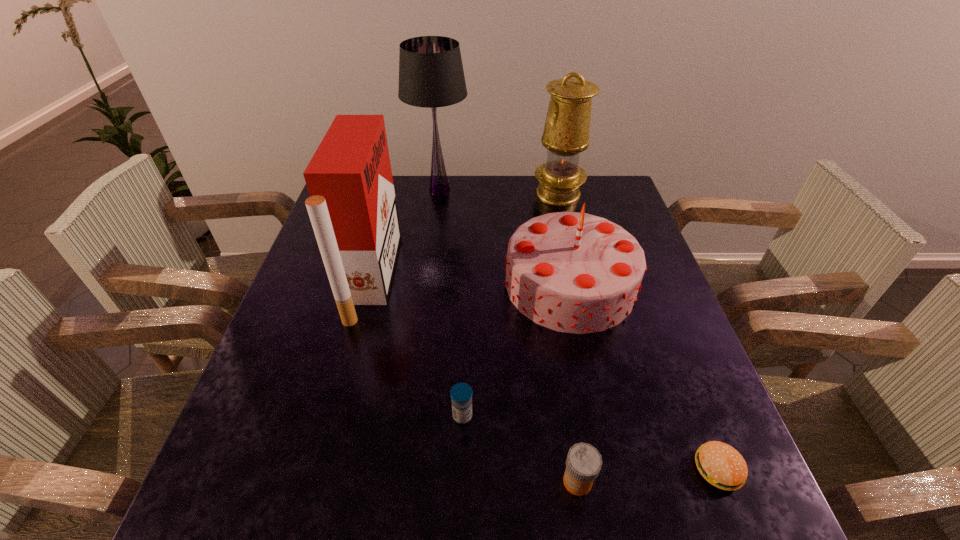
The height and width of the screenshot is (540, 960). In order to click on empty space that is in between the farther medicine and the cigarette case in this screenshot , I will do tap(418, 346).

Where is `vacant space in between the lampshade and the oil lamp`? vacant space in between the lampshade and the oil lamp is located at coordinates (499, 192).

Locate an element on the screen. The image size is (960, 540). vacant space that is in between the right medicine and the left medicine is located at coordinates (520, 449).

Identify which object is located as the sixth nearest to the oil lamp. Please provide its 2D coordinates. Your answer should be formatted as a tuple, i.e. [(x, y)], where the tuple contains the x and y coordinates of a point satisfying the conditions above.

[(583, 463)]

I want to click on object that stands as the second closest to the fourth tallest object, so click(x=461, y=393).

Where is `vacant space that satisfies the following two spatial constraints: 1. on the front-facing side of the cigarette case; 2. on the right side of the birthday cake`? This screenshot has height=540, width=960. vacant space that satisfies the following two spatial constraints: 1. on the front-facing side of the cigarette case; 2. on the right side of the birthday cake is located at coordinates (370, 285).

The height and width of the screenshot is (540, 960). In order to click on free space that satisfies the following two spatial constraints: 1. on the front-facing side of the patty; 2. on the right side of the cigarette case in this screenshot , I will do `click(322, 470)`.

Image resolution: width=960 pixels, height=540 pixels. Identify the location of vacant space that satisfies the following two spatial constraints: 1. on the front-facing side of the lampshade; 2. on the front-facing side of the cigarette case. pos(429,276).

Identify the location of vacant space that satisfies the following two spatial constraints: 1. on the front-facing side of the lampshade; 2. on the front-facing side of the cigarette case. (429, 276).

Where is `vacant position in the image that satisfies the following two spatial constraints: 1. on the front-facing side of the oil lamp; 2. on the right side of the lampshade`? Image resolution: width=960 pixels, height=540 pixels. vacant position in the image that satisfies the following two spatial constraints: 1. on the front-facing side of the oil lamp; 2. on the right side of the lampshade is located at coordinates (440, 194).